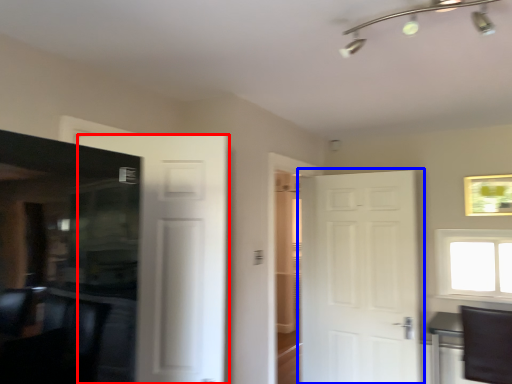
Question: Which point is closer to the camera, door (highlighted by a red box) or door (highlighted by a blue box)?

Choices:
 (A) door
 (B) door

Answer: (A)